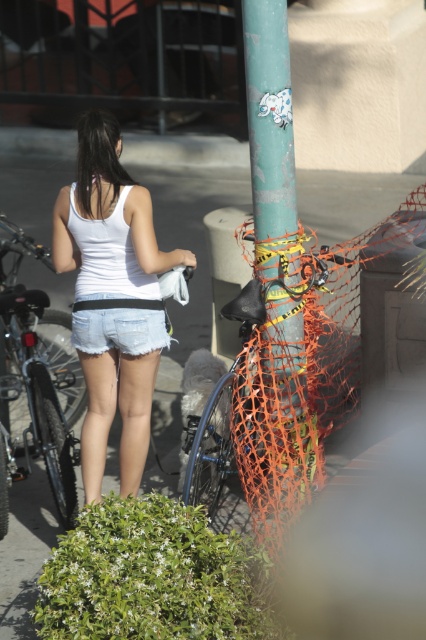
Does shiny metallic bicycle at left have a larger size compared to denim shorts at center?

Yes.

At what (x,y) coordinates should I click in order to perform the action: click on shiny metallic bicycle at left. Please return your answer as a coordinate pair (x, y). This screenshot has height=640, width=426. Looking at the image, I should click on (37, 378).

Is point (13, 392) in front of point (112, 344)?

No, (13, 392) is further to viewer.

Locate an element on the screen. The height and width of the screenshot is (640, 426). shiny metallic bicycle at left is located at coordinates (37, 378).

Is white denim shorts at center to the left of denim shorts at center from the viewer's perspective?

Incorrect, white denim shorts at center is not on the left side of denim shorts at center.

Who is positioned more to the left, white denim shorts at center or denim shorts at center?

Positioned to the left is denim shorts at center.

Which is in front, point (141, 202) or point (112, 348)?

Point (141, 202) is in front.

Locate an element on the screen. The width and height of the screenshot is (426, 640). white denim shorts at center is located at coordinates (108, 220).

Can you confirm if white denim shorts at center is bigger than green matte pole at center?

Incorrect, white denim shorts at center is not larger than green matte pole at center.

Who is taller, white denim shorts at center or green matte pole at center?

Standing taller between the two is green matte pole at center.

Describe the element at coordinates (108, 220) in the screenshot. I see `white denim shorts at center` at that location.

Identify the location of white denim shorts at center. Image resolution: width=426 pixels, height=640 pixels. (108, 220).